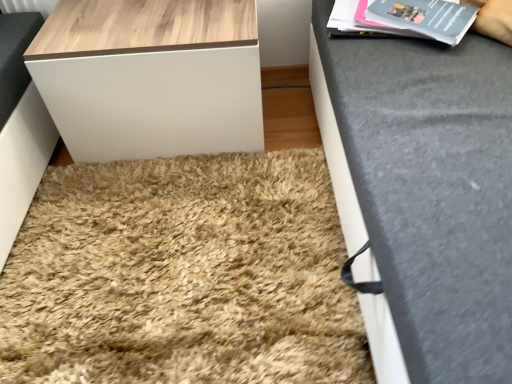
The image size is (512, 384). Find the location of `beige shaggy rug at center`. beige shaggy rug at center is located at coordinates (182, 275).

This screenshot has width=512, height=384. What do you see at coordinates (404, 18) in the screenshot?
I see `matte gray magazine at upper right` at bounding box center [404, 18].

At what (x,y) coordinates should I click in order to perform the action: click on matte gray magazine at upper right. Please return your answer as a coordinate pair (x, y). Image resolution: width=512 pixels, height=384 pixels. Looking at the image, I should click on (404, 18).

Where is `beige shaggy rug at center`? beige shaggy rug at center is located at coordinates (182, 275).

Consider the image. Visually, is matte gray magazine at upper right positioned to the left or to the right of beige shaggy rug at center?

In the image, matte gray magazine at upper right appears on the right side of beige shaggy rug at center.

In terms of width, does matte gray magazine at upper right look wider or thinner when compared to beige shaggy rug at center?

In the image, matte gray magazine at upper right appears to be more narrow than beige shaggy rug at center.

Which is in front, point (450, 19) or point (339, 271)?

The point (339, 271) is closer to the camera.

The image size is (512, 384). I want to click on mat below the matte gray magazine at upper right (from a real-world perspective), so click(x=182, y=275).

Looking at this image, is wooden table at upper left at the left side of beige shaggy rug at center?

Yes, wooden table at upper left is to the left of beige shaggy rug at center.

Looking at this image, considering the positions of objects wooden table at upper left and beige shaggy rug at center in the image provided, who is behind, wooden table at upper left or beige shaggy rug at center?

Positioned behind is wooden table at upper left.

Would you consider wooden table at upper left to be distant from beige shaggy rug at center?

wooden table at upper left is actually quite close to beige shaggy rug at center.

Is wooden table at upper left looking in the opposite direction of beige shaggy rug at center?

wooden table at upper left is not turned away from beige shaggy rug at center.

Considering the sizes of objects beige shaggy rug at center and wooden table at upper left in the image provided, who is smaller, beige shaggy rug at center or wooden table at upper left?

beige shaggy rug at center is smaller.

Consider the image. Is beige shaggy rug at center surrounding wooden table at upper left?

No, wooden table at upper left is not a part of beige shaggy rug at center.

Between beige shaggy rug at center and wooden table at upper left, which one appears on the left side from the viewer's perspective?

wooden table at upper left is more to the left.

Would you say beige shaggy rug at center is a long distance from wooden table at upper left?

No, beige shaggy rug at center is not far away from wooden table at upper left.

Can you confirm if matte gray magazine at upper right is shorter than wooden table at upper left?

Yes, matte gray magazine at upper right is shorter than wooden table at upper left.

From the image's perspective, which one is positioned lower, matte gray magazine at upper right or wooden table at upper left?

wooden table at upper left is shown below in the image.

Who is smaller, matte gray magazine at upper right or wooden table at upper left?

matte gray magazine at upper right.

From a real-world perspective, is matte gray magazine at upper right located beneath wooden table at upper left?

No, from a real-world perspective, matte gray magazine at upper right is not beneath wooden table at upper left.

Which of these two, beige shaggy rug at center or matte gray magazine at upper right, is wider?

Wider between the two is beige shaggy rug at center.

In the scene shown: Is beige shaggy rug at center not inside matte gray magazine at upper right?

beige shaggy rug at center is positioned outside matte gray magazine at upper right.

From the picture: Is beige shaggy rug at center far away from matte gray magazine at upper right?

Actually, beige shaggy rug at center and matte gray magazine at upper right are a little close together.

From a real-world perspective, is wooden table at upper left below matte gray magazine at upper right?

Indeed, from a real-world perspective, wooden table at upper left is positioned beneath matte gray magazine at upper right.

Considering the positions of objects wooden table at upper left and matte gray magazine at upper right in the image provided, who is more to the right, wooden table at upper left or matte gray magazine at upper right?

matte gray magazine at upper right is more to the right.

Is the position of wooden table at upper left more distant than that of matte gray magazine at upper right?

Yes, wooden table at upper left is further from the camera.

Is wooden table at upper left next to matte gray magazine at upper right?

They are not placed beside each other.

There is a beige shaggy rug at center. Where is `magazine above it (from a real-world perspective)`? magazine above it (from a real-world perspective) is located at coordinates (404, 18).

Identify the location of mat below the wooden table at upper left (from the image's perspective). Image resolution: width=512 pixels, height=384 pixels. (182, 275).

Which object lies nearer to the anchor point beige shaggy rug at center, wooden table at upper left or matte gray magazine at upper right?

Based on the image, wooden table at upper left appears to be nearer to beige shaggy rug at center.

Based on their spatial positions, is matte gray magazine at upper right or beige shaggy rug at center further from wooden table at upper left?

matte gray magazine at upper right.

When comparing their distances from matte gray magazine at upper right, does wooden table at upper left or beige shaggy rug at center seem further?

beige shaggy rug at center.

Looking at the image, which one is located further to matte gray magazine at upper right, beige shaggy rug at center or wooden table at upper left?

beige shaggy rug at center lies further to matte gray magazine at upper right than the other object.

When comparing their distances from beige shaggy rug at center, does matte gray magazine at upper right or wooden table at upper left seem further?

matte gray magazine at upper right is further to beige shaggy rug at center.

Considering their positions, is beige shaggy rug at center positioned further to wooden table at upper left than matte gray magazine at upper right?

matte gray magazine at upper right.

Where is `mat located between wooden table at upper left and matte gray magazine at upper right in the left-right direction`? The width and height of the screenshot is (512, 384). mat located between wooden table at upper left and matte gray magazine at upper right in the left-right direction is located at coordinates (182, 275).